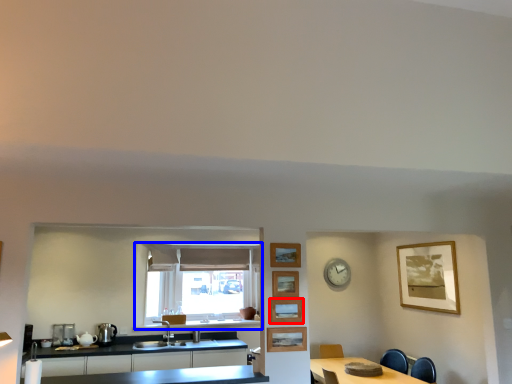
Question: Which of the following is the farthest to the observer, picture frame (highlighted by a red box) or window (highlighted by a blue box)?

Choices:
 (A) picture frame
 (B) window

Answer: (B)